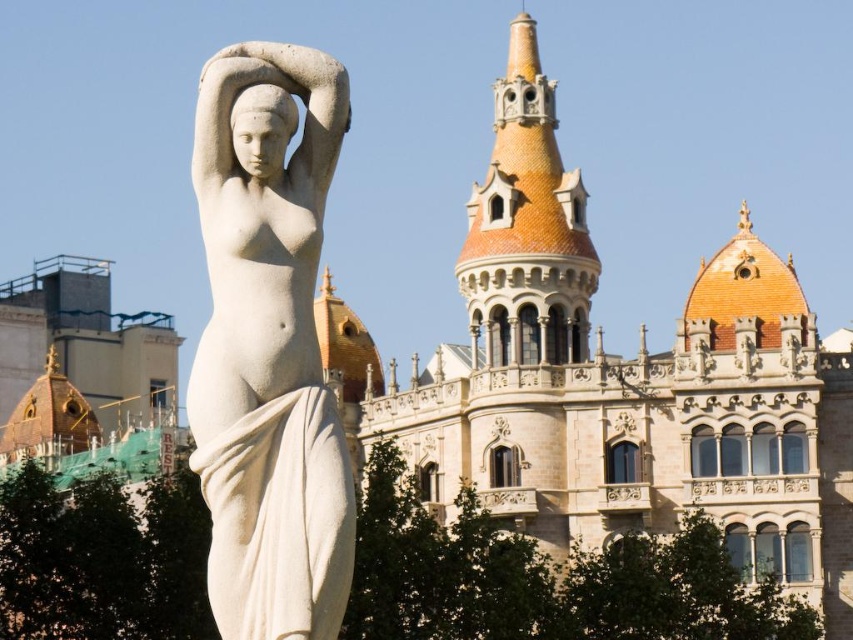
Is brown stone palace at center taller than terracotta tiled tower at upper center?

Correct, brown stone palace at center is much taller as terracotta tiled tower at upper center.

Is brown stone palace at center to the right of terracotta tiled tower at upper center from the viewer's perspective?

Yes, brown stone palace at center is to the right of terracotta tiled tower at upper center.

This screenshot has width=853, height=640. I want to click on brown stone palace at center, so [621, 381].

Locate an element on the screen. This screenshot has width=853, height=640. brown stone palace at center is located at coordinates (621, 381).

Who is more distant from viewer, (500,330) or (294,605)?

Positioned behind is point (500,330).

In the scene shown: Is brown stone palace at center below white marble statue at center?

Actually, brown stone palace at center is above white marble statue at center.

Between point (743, 294) and point (194, 422), which one is positioned behind?

Positioned behind is point (743, 294).

Identify the location of brown stone palace at center. This screenshot has height=640, width=853. (621, 381).

Who is positioned more to the right, white marble statue at center or terracotta tiled tower at upper center?

Positioned to the right is terracotta tiled tower at upper center.

Who is shorter, white marble statue at center or terracotta tiled tower at upper center?

Standing shorter between the two is white marble statue at center.

Find the location of `white marble statue at center`. white marble statue at center is located at coordinates (268, 346).